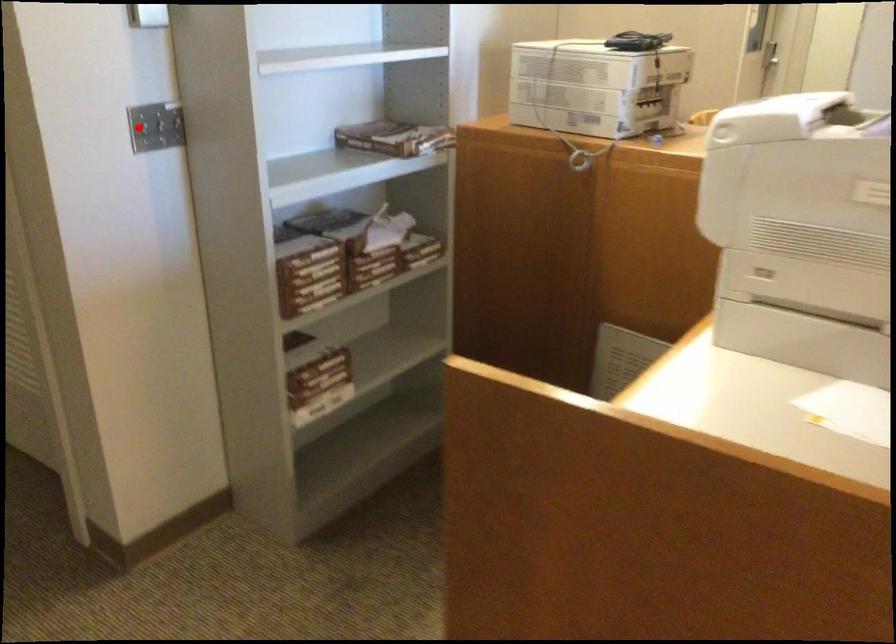
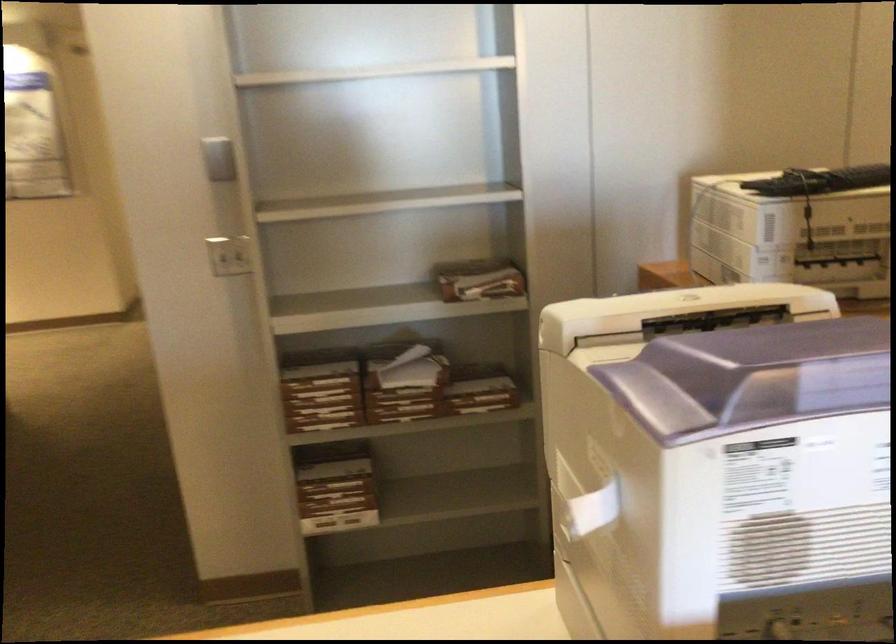
The point at the highlighted location is marked in the first image. Where is the corresponding point in the second image?

(228, 254)